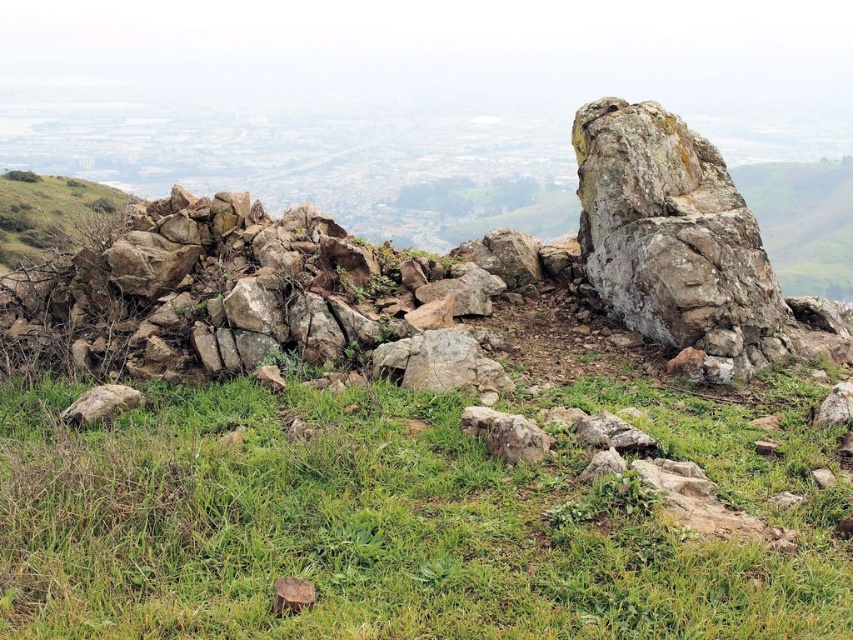
Does rusty metallic rock at center appear on the left side of gray rough rock at center?

Correct, you'll find rusty metallic rock at center to the left of gray rough rock at center.

Can you confirm if rusty metallic rock at center is bigger than gray rough rock at center?

Yes.

What do you see at coordinates (439, 364) in the screenshot?
I see `rusty metallic rock at center` at bounding box center [439, 364].

Image resolution: width=853 pixels, height=640 pixels. Find the location of `rusty metallic rock at center`. rusty metallic rock at center is located at coordinates (439, 364).

Can you confirm if rough textured rock at center is thinner than rusty metallic rock at center?

In fact, rough textured rock at center might be wider than rusty metallic rock at center.

Which of these two, rough textured rock at center or rusty metallic rock at center, stands shorter?

rusty metallic rock at center is shorter.

Locate an element on the screen. rough textured rock at center is located at coordinates click(672, 237).

Between point (540, 595) and point (531, 458), which one is positioned behind?

The point (531, 458) is more distant.

Measure the distance between green grassy at lower center and camera.

green grassy at lower center is 10.03 feet away from camera.

Which is in front, point (357, 461) or point (492, 444)?

Point (357, 461)

At what (x,y) coordinates should I click in order to perform the action: click on green grassy at lower center. Please return your answer as a coordinate pair (x, y). The width and height of the screenshot is (853, 640). Looking at the image, I should click on (393, 522).